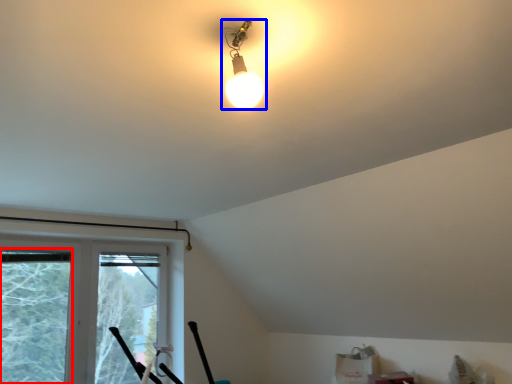
Question: Among these objects, which one is farthest to the camera, window screen (highlighted by a red box) or lamp (highlighted by a blue box)?

Choices:
 (A) window screen
 (B) lamp

Answer: (A)